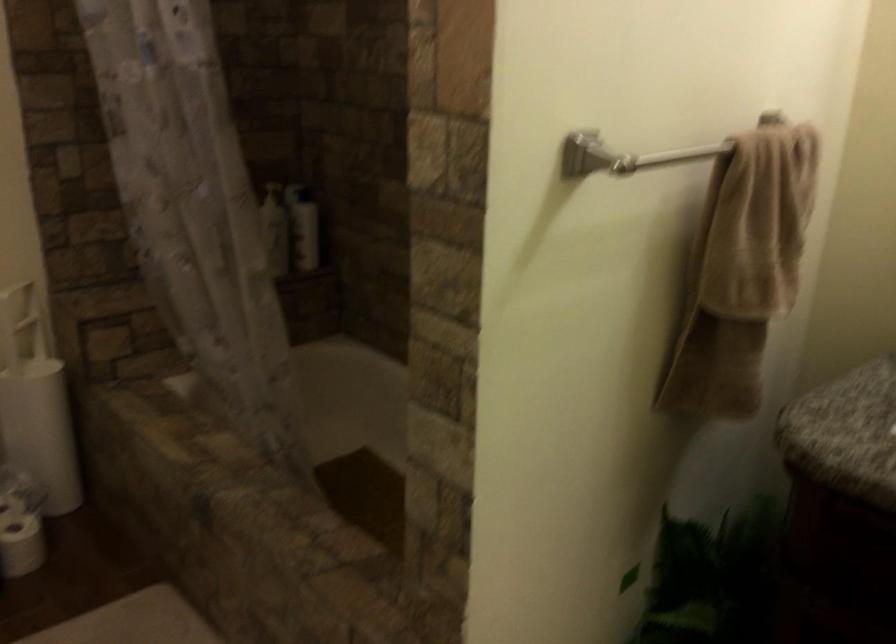
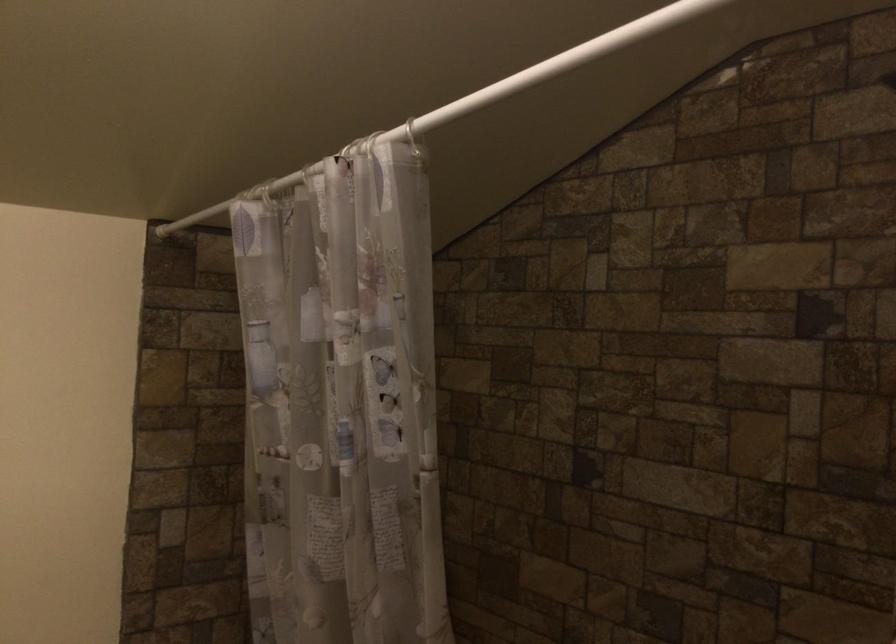
Question: How did the camera likely rotate?

Choices:
 (A) Left
 (B) Right
 (C) Up
 (D) Down

Answer: (C)